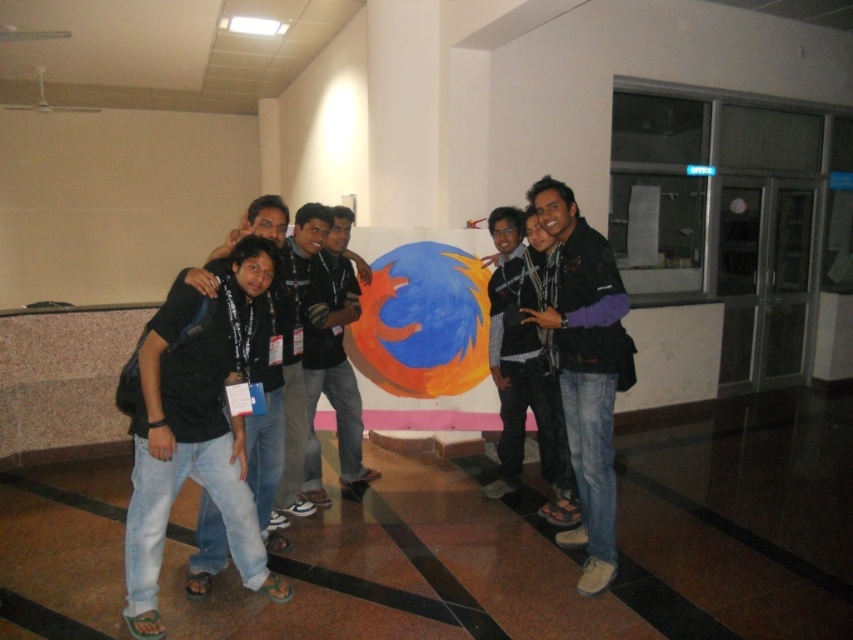
Based on the photo, you are organizing a photo shoot and need to ensure that the purple fleece jacket at center and the matte black shirt at center are both visible in the final image. Given their sizes, which one might require more careful framing to avoid being overshadowed?

The purple fleece jacket at center has a larger size compared to matte black shirt at center, so the matte black shirt at center might require more careful framing to avoid being overshadowed.

You are a photographer trying to adjust the lighting for a group photo. You notice the black matte shirt at center and the jeans at center. Which clothing item requires more space in the frame to capture its full width?

The black matte shirt at center requires more space in the frame to capture its full width because its width is larger than the jeans at center.

In the scene described, where is the black matte shirt at center in relation to the jeans at center?

The black matte shirt at center is to the left of the jeans at center.